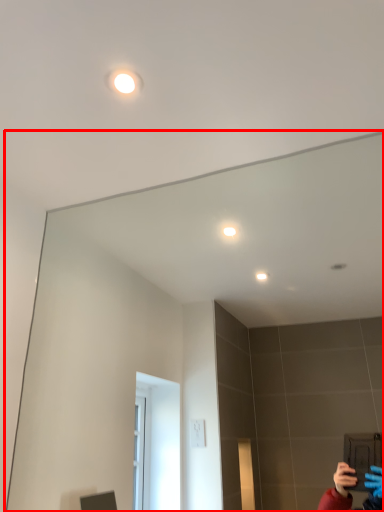
Question: In this image, where is mirror (annotated by the red box) located relative to light?

Choices:
 (A) right
 (B) left

Answer: (A)